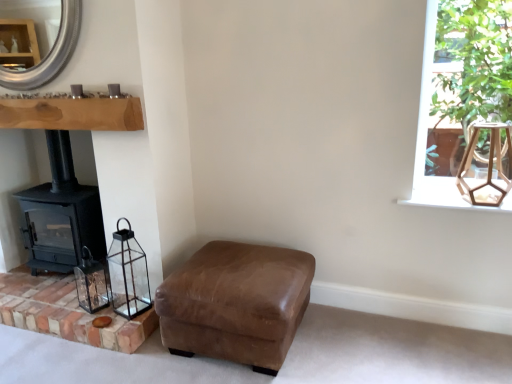
Locate an element on the screen. Image resolution: width=512 pixels, height=384 pixels. green leafy plant at upper right is located at coordinates (430, 128).

Describe the element at coordinates (236, 303) in the screenshot. The width and height of the screenshot is (512, 384). I see `brown leather ottoman at lower center` at that location.

What do you see at coordinates (91, 285) in the screenshot? I see `clear glass lantern at lower left` at bounding box center [91, 285].

Describe the element at coordinates (61, 214) in the screenshot. Image resolution: width=512 pixels, height=384 pixels. I see `black matte wood burning stove at left` at that location.

At what (x,y) coordinates should I click in order to perform the action: click on wooden hexagonal lantern at upper right, marked as the 1th lamp in a right-to-left arrangement. Please return your answer as a coordinate pair (x, y). This screenshot has height=384, width=512. Looking at the image, I should click on (488, 164).

Is green leafy plant at upper right oriented away from brown leather ottoman at lower center?

green leafy plant at upper right does not have its back to brown leather ottoman at lower center.

Are green leafy plant at upper right and brown leather ottoman at lower center far apart?

That's not correct — green leafy plant at upper right is a little close to brown leather ottoman at lower center.

Is green leafy plant at upper right spatially inside brown leather ottoman at lower center, or outside of it?

green leafy plant at upper right cannot be found inside brown leather ottoman at lower center.

Between green leafy plant at upper right and brown leather ottoman at lower center, which one is positioned in front?

brown leather ottoman at lower center is more forward.

Considering the sizes of objects black matte wood burning stove at left and clear glass lantern at lower left in the image provided, who is shorter, black matte wood burning stove at left or clear glass lantern at lower left?

Standing shorter between the two is clear glass lantern at lower left.

Could you tell me if black matte wood burning stove at left is turned towards clear glass lantern at lower left?

No, black matte wood burning stove at left is not aimed at clear glass lantern at lower left.

Measure the distance between black matte wood burning stove at left and clear glass lantern at lower left.

13.18 inches.

Considering the relative sizes of black matte wood burning stove at left and clear glass lantern at lower left in the image provided, is black matte wood burning stove at left bigger than clear glass lantern at lower left?

Yes, black matte wood burning stove at left is bigger than clear glass lantern at lower left.

Would you say clear glass lantern at lower left contains brickroughbrickwork at lower left?

No, brickroughbrickwork at lower left is not a part of clear glass lantern at lower left.

Is clear glass lantern at lower left next to brickroughbrickwork at lower left?

No, clear glass lantern at lower left is not next to brickroughbrickwork at lower left.

Between clear glass lantern at lower left and brickroughbrickwork at lower left, which one has smaller width?

Thinner between the two is clear glass lantern at lower left.

Based on the photo, how far apart are clear glass lantern at lower left and brickroughbrickwork at lower left?

A distance of 7.47 inches exists between clear glass lantern at lower left and brickroughbrickwork at lower left.

How far apart are green leafy plant at upper right and silver metallic mirror at upper left?

green leafy plant at upper right is 6.19 feet away from silver metallic mirror at upper left.

Is green leafy plant at upper right positioned with its back to silver metallic mirror at upper left?

No.

In the scene shown: Does green leafy plant at upper right touch silver metallic mirror at upper left?

No.

Identify the location of fireplace lying behind the green leafy plant at upper right. The width and height of the screenshot is (512, 384). (50, 53).

Is the depth of clear glass lantern at lower left greater than that of wooden hexagonal lantern at upper right, arranged as the 2th lamp when viewed from the left?

Yes, clear glass lantern at lower left is further from the camera.

Which of these two, clear glass lantern at lower left or wooden hexagonal lantern at upper right, positioned as the first lamp in top-to-bottom order, stands taller?

Standing taller between the two is wooden hexagonal lantern at upper right, positioned as the first lamp in top-to-bottom order.

How different are the orientations of clear glass lantern at lower left and wooden hexagonal lantern at upper right, arranged as the 2th lamp when viewed from the left, in degrees?

clear glass lantern at lower left and wooden hexagonal lantern at upper right, arranged as the 2th lamp when viewed from the left, are facing 22.2 degrees away from each other.

Is clear glass lantern at lower left next to wooden hexagonal lantern at upper right, the 2th lamp in the bottom-to-top sequence, and touching it?

They are not placed beside each other.

Looking at their sizes, would you say brickroughbrickwork at lower left is wider or thinner than black matte wood burning stove at left?

Considering their sizes, brickroughbrickwork at lower left looks broader than black matte wood burning stove at left.

Is brickroughbrickwork at lower left inside the boundaries of black matte wood burning stove at left, or outside?

brickroughbrickwork at lower left is located beyond the bounds of black matte wood burning stove at left.

Is brickroughbrickwork at lower left aimed at black matte wood burning stove at left?

No.

How many degrees apart are the facing directions of brickroughbrickwork at lower left and black matte wood burning stove at left?

The angle between the facing direction of brickroughbrickwork at lower left and the facing direction of black matte wood burning stove at left is 0.000714 degrees.

Can you confirm if brown leather ottoman at lower center is positioned to the right of black matte wood burning stove at left?

Correct, you'll find brown leather ottoman at lower center to the right of black matte wood burning stove at left.

Can you confirm if brown leather ottoman at lower center is shorter than black matte wood burning stove at left?

Yes.

Is brown leather ottoman at lower center facing away from black matte wood burning stove at left?

No, brown leather ottoman at lower center is not facing away from black matte wood burning stove at left.

Which is in front, brown leather ottoman at lower center or black matte wood burning stove at left?

Positioned in front is brown leather ottoman at lower center.

I want to click on window behind the brown leather ottoman at lower center, so click(x=430, y=128).

Where is `wood burning stove above the clear glass lantern at lower left (from a real-world perspective)`? wood burning stove above the clear glass lantern at lower left (from a real-world perspective) is located at coordinates (61, 214).

Considering their positions, is brown leather ottoman at lower center positioned further to silver metallic mirror at upper left than green leafy plant at upper right?

green leafy plant at upper right is positioned further to the anchor silver metallic mirror at upper left.

Looking at the image, which one is located further to silver metallic mirror at upper left, wooden hexagonal lantern at upper right, positioned as the first lamp in top-to-bottom order, or brown leather ottoman at lower center?

Based on the image, wooden hexagonal lantern at upper right, positioned as the first lamp in top-to-bottom order, appears to be further to silver metallic mirror at upper left.

Considering their positions, is green leafy plant at upper right positioned further to clear glass lantern at lower left, positioned as the second lamp in right-to-left order, than silver metallic mirror at upper left?

green leafy plant at upper right is further to clear glass lantern at lower left, positioned as the second lamp in right-to-left order.

Looking at the image, which one is located closer to silver metallic mirror at upper left, wooden hexagonal lantern at upper right, marked as the 1th lamp in a right-to-left arrangement, or brickroughbrickwork at lower left?

brickroughbrickwork at lower left is closer to silver metallic mirror at upper left.

Looking at the image, which one is located closer to brown leather ottoman at lower center, clear glass lantern at lower left, the 1th lamp positioned from the bottom, or silver metallic mirror at upper left?

The object closer to brown leather ottoman at lower center is clear glass lantern at lower left, the 1th lamp positioned from the bottom.

Looking at the image, which one is located closer to clear glass lantern at lower left, positioned as the second lamp in right-to-left order, silver metallic mirror at upper left or black matte wood burning stove at left?

black matte wood burning stove at left lies closer to clear glass lantern at lower left, positioned as the second lamp in right-to-left order, than the other object.

Based on their spatial positions, is black matte wood burning stove at left or clear glass lantern at lower left closer to brown leather ottoman at lower center?

clear glass lantern at lower left is closer to brown leather ottoman at lower center.

Based on their spatial positions, is black matte wood burning stove at left or green leafy plant at upper right closer to brickroughbrickwork at lower left?

black matte wood burning stove at left.

At what (x,y) coordinates should I click in order to perform the action: click on lamp situated between black matte wood burning stove at left and brown leather ottoman at lower center from left to right. Please return your answer as a coordinate pair (x, y). The width and height of the screenshot is (512, 384). Looking at the image, I should click on (128, 274).

The image size is (512, 384). Find the location of `armchair located between clear glass lantern at lower left and green leafy plant at upper right in the left-right direction`. armchair located between clear glass lantern at lower left and green leafy plant at upper right in the left-right direction is located at coordinates [x=236, y=303].

The image size is (512, 384). I want to click on armchair between brickroughbrickwork at lower left and wooden hexagonal lantern at upper right, the 2th lamp in the bottom-to-top sequence, so click(236, 303).

Identify the location of armchair situated between black matte wood burning stove at left and green leafy plant at upper right from left to right. This screenshot has height=384, width=512. (236, 303).